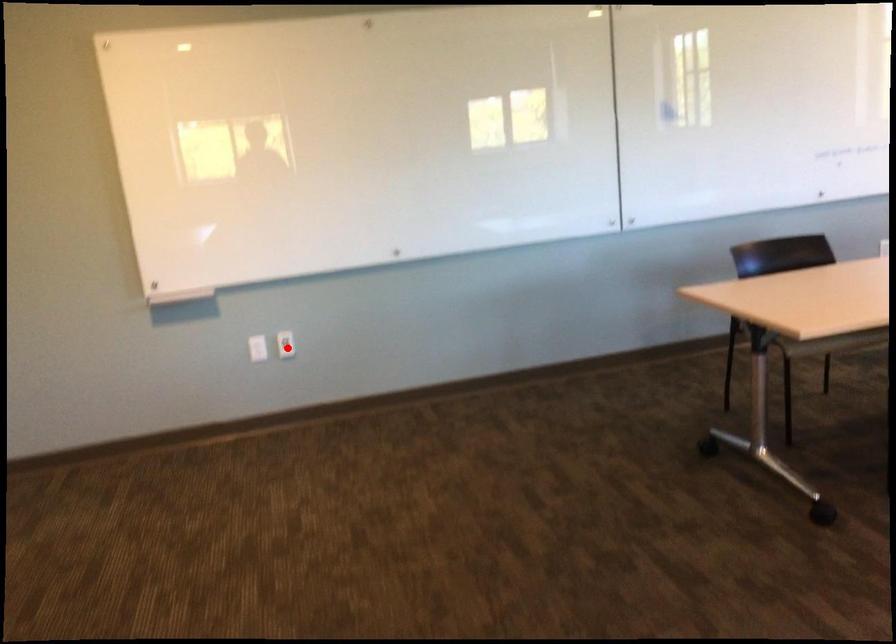
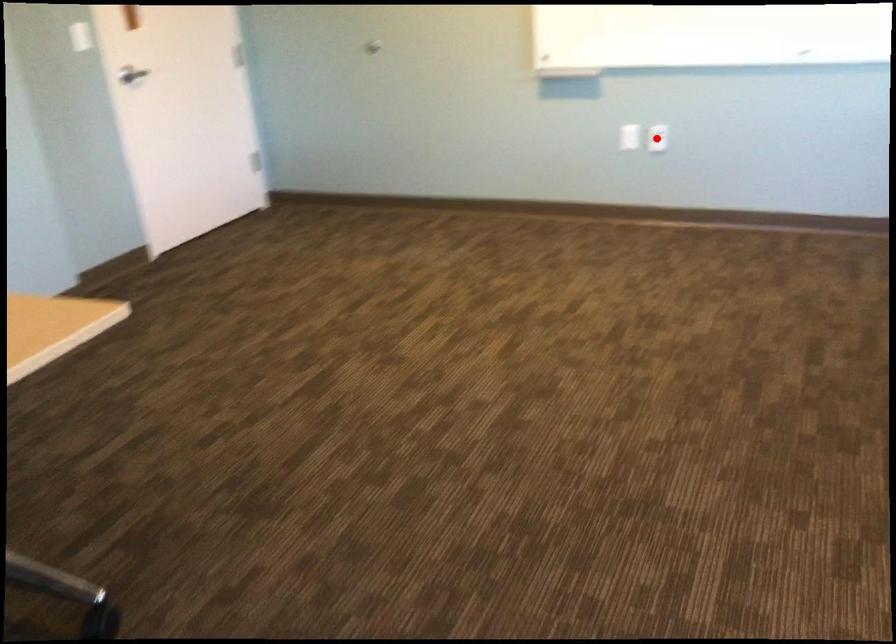
I am providing you with two images of the same scene from different viewpoints. A red point is marked on the first image and another point is marked on the second image. Does the point marked in image1 correspond to the same location as the one in image2?

Yes